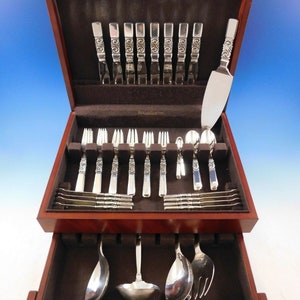
This screenshot has width=300, height=300. Identify the location of forks. (84, 132), (99, 134), (115, 136), (129, 136), (150, 139), (162, 136).